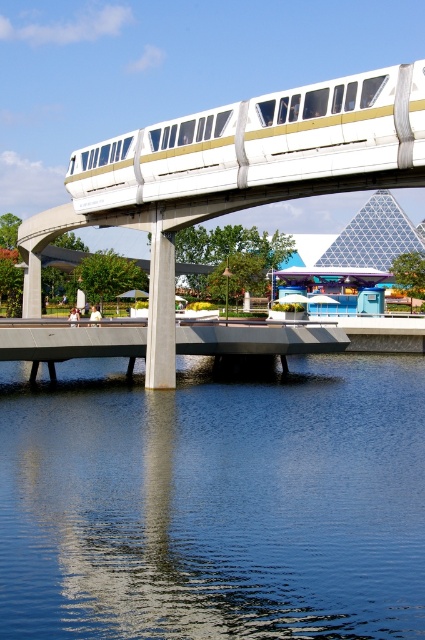
Question: Is blue smooth water at center below white glossy monorail at upper center?

Choices:
 (A) no
 (B) yes

Answer: (B)

Question: Which point is farther to the camera?

Choices:
 (A) (255, 477)
 (B) (220, 144)

Answer: (B)

Question: Which point is closer to the camera taking this photo?

Choices:
 (A) (62, 381)
 (B) (161, 124)

Answer: (B)

Question: Where is blue smooth water at center located in relation to white glossy monorail at upper center in the image?

Choices:
 (A) left
 (B) right

Answer: (B)

Question: Is blue smooth water at center bigger than white glossy monorail at upper center?

Choices:
 (A) yes
 (B) no

Answer: (A)